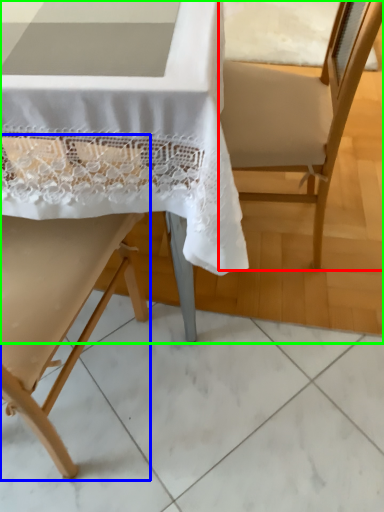
Question: Which is farther away from armchair (highlighted by a red box)? chair (highlighted by a blue box) or chair (highlighted by a green box)?

Choices:
 (A) chair
 (B) chair

Answer: (A)